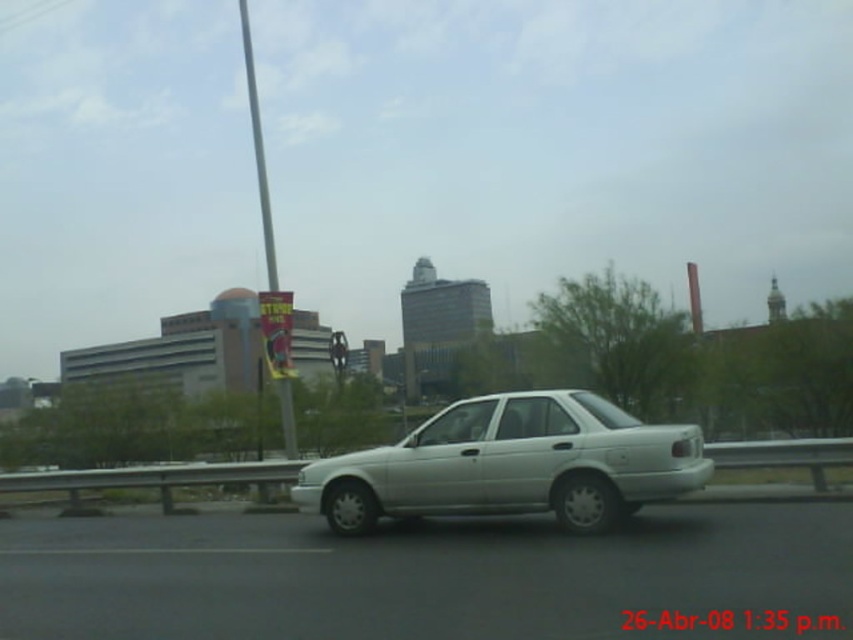
You are a passenger in a car and you see a point at coordinate (415,573). What object is located at that point?

The white metallic car at center is located at point (415,573).

You are a passenger in the white matte sedan at center. You notice a metallic pole at center above you. Is the pole directly above the sedan or to the side?

The white matte sedan at center is positioned under the metallic pole at center, so the pole is directly above the sedan.

You are a passenger in a car and notice two vehicles ahead on the road. The white metallic car at center and the white matte sedan at center. Which one appears bigger from your viewpoint?

The white metallic car at center appears bigger than the white matte sedan at center because it has a larger size compared to it.